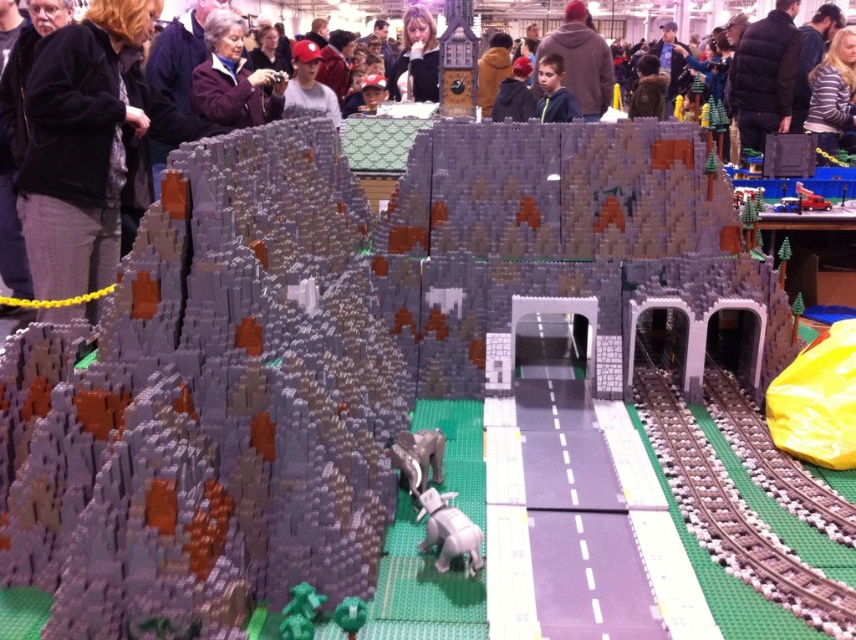
Question: Which of these objects is positioned closest to the green matte tree at lower center?

Choices:
 (A) striped sweater at upper right
 (B) metallic silver car at center
 (C) white plastic elephant at center

Answer: (B)

Question: Which of these objects is positioned closest to the green matte tree at lower center?

Choices:
 (A) green matte tree at lower left
 (B) metallic silver car at center
 (C) blue shirt at upper center

Answer: (A)

Question: Can you confirm if matte purple jacket at upper left is positioned below metallic silver car at center?

Choices:
 (A) no
 (B) yes

Answer: (A)

Question: Which point is closer to the camera?

Choices:
 (A) white plastic elephant at center
 (B) striped sweater at upper right
 (C) matte purple jacket at upper left
 (D) green matte tree at lower center

Answer: (D)

Question: Where is striped sweater at upper right located in relation to green matte tree at lower left in the image?

Choices:
 (A) right
 (B) left

Answer: (A)

Question: Considering the relative positions of white plastic elephant at center and green matte tree at lower left in the image provided, where is white plastic elephant at center located with respect to green matte tree at lower left?

Choices:
 (A) left
 (B) right

Answer: (B)